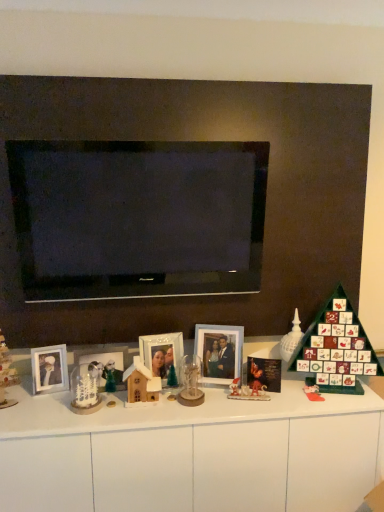
At what (x,y) coordinates should I click in order to perform the action: click on vacant space to the left of wooden house at center, the third toy viewed from the back. Please return your answer as a coordinate pair (x, y). Looking at the image, I should click on (102, 408).